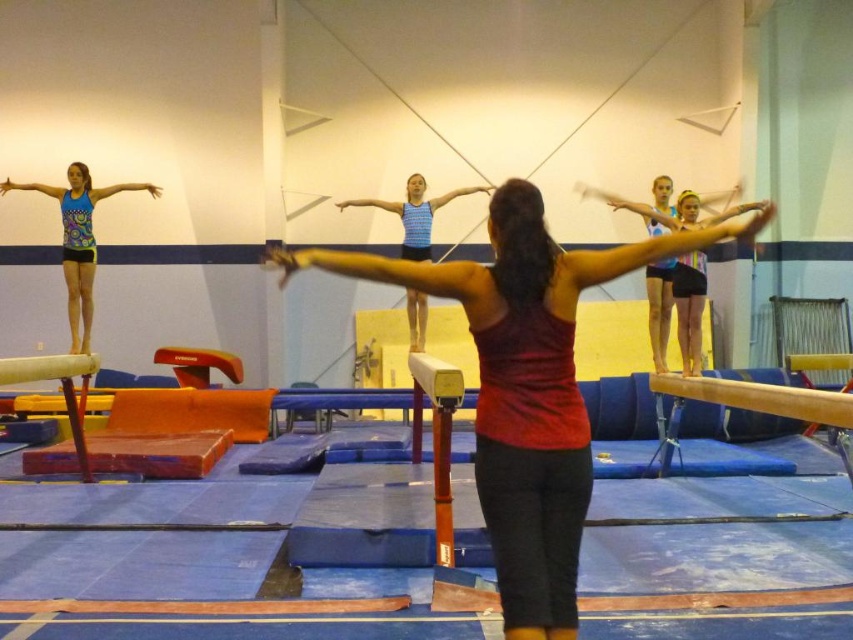
Question: Which of these objects is positioned closest to the matte blue tank top at left?

Choices:
 (A) blue striped tank top at center
 (B) wooden beam at right
 (C) red matte tank top at center
 (D) smooth wooden balance beam at lower left

Answer: (D)

Question: Which of the following is the closest to the observer?

Choices:
 (A) (700, 397)
 (B) (492, 392)
 (C) (55, 358)
 (D) (430, 209)

Answer: (B)

Question: Which point is farther to the camera?

Choices:
 (A) matte blue tank top at left
 (B) red matte tank top at center
 (C) wooden beam at right

Answer: (A)

Question: Considering the relative positions of red matte tank top at center and smooth wooden balance beam at lower left in the image provided, where is red matte tank top at center located with respect to smooth wooden balance beam at lower left?

Choices:
 (A) left
 (B) right

Answer: (B)

Question: From the image, what is the correct spatial relationship of red matte tank top at center in relation to smooth wooden balance beam at lower left?

Choices:
 (A) right
 (B) left

Answer: (A)

Question: Can you confirm if red matte tank top at center is wider than blue striped tank top at center?

Choices:
 (A) yes
 (B) no

Answer: (A)